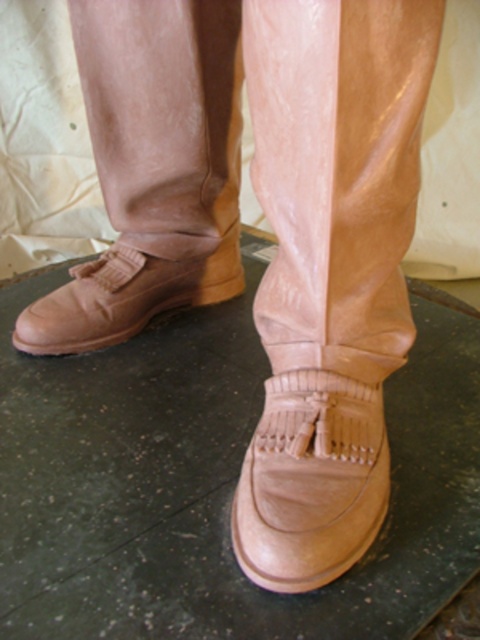
Can you confirm if matte tan boot at lower left is positioned below leather boot at lower center?

No.

Is matte tan boot at lower left shorter than leather boot at lower center?

In fact, matte tan boot at lower left may be taller than leather boot at lower center.

Does point (56, 298) come behind point (298, 536)?

Yes, point (56, 298) is behind point (298, 536).

Where is `matte tan boot at lower left`? The width and height of the screenshot is (480, 640). matte tan boot at lower left is located at coordinates (x=153, y=168).